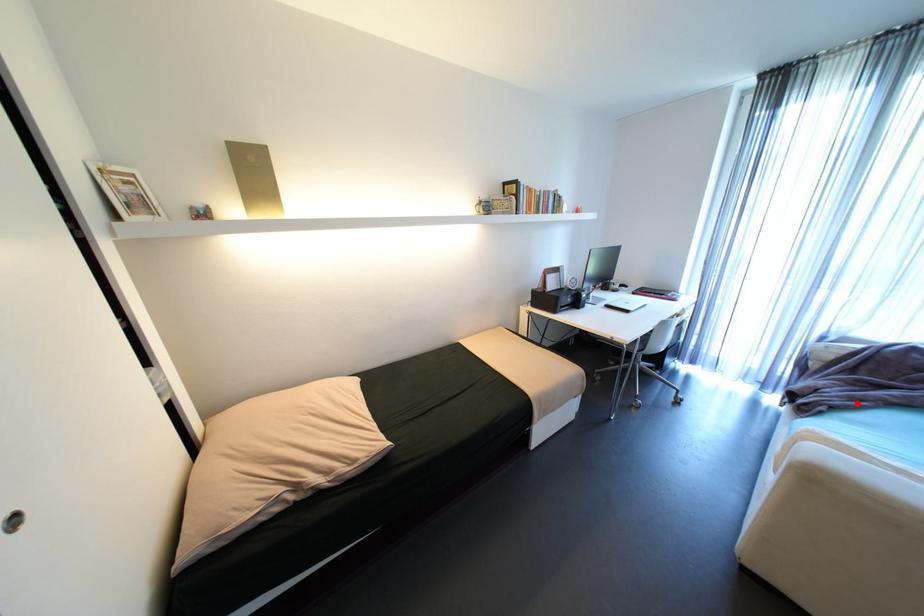
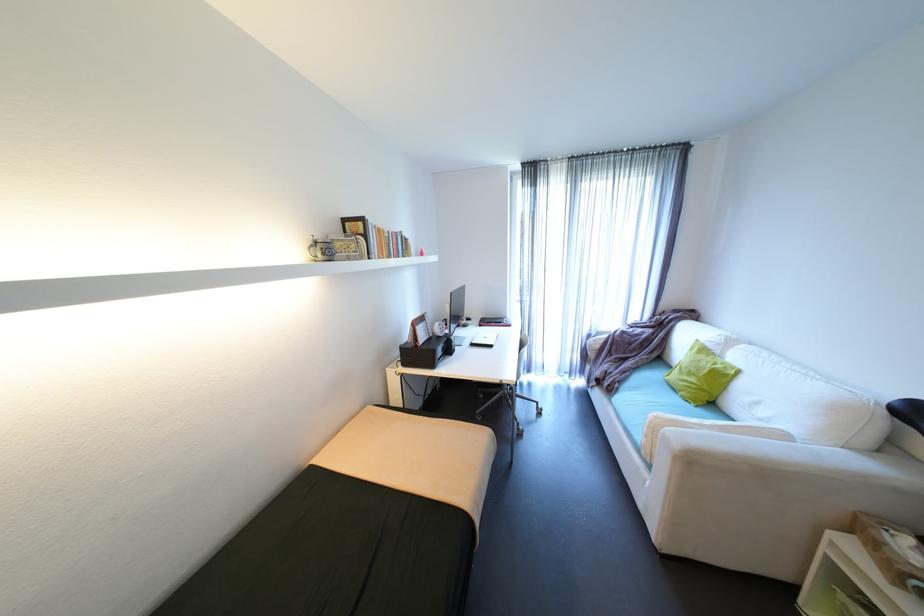
Find the pixel in the second image that matches the highlighted location in the first image.

(630, 377)